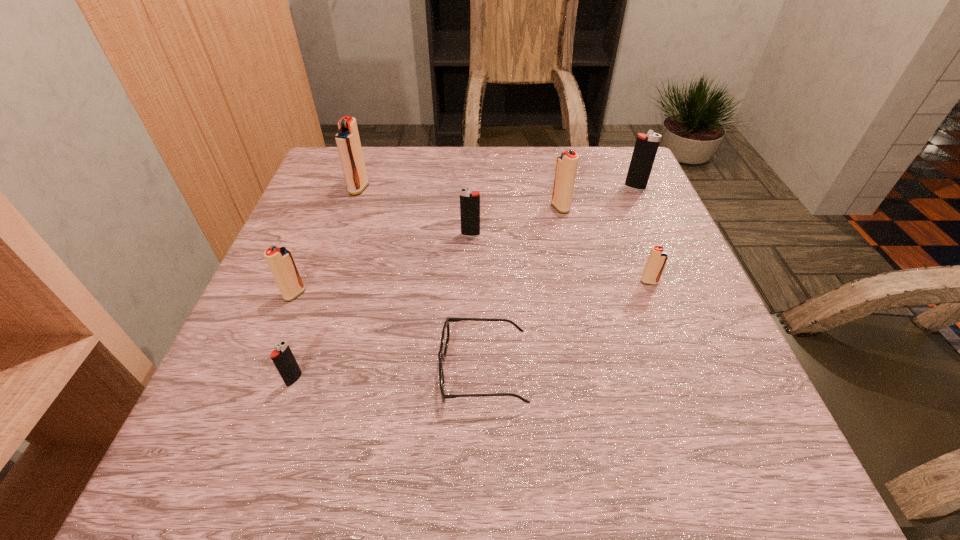
The image size is (960, 540). In order to click on free space that is in between the fourth farthest object and the sixth farthest igniter in this screenshot , I will do `click(383, 264)`.

This screenshot has width=960, height=540. I want to click on empty space that is in between the rightmost object and the tallest igniter, so click(x=497, y=188).

The image size is (960, 540). I want to click on free spot between the smallest black igniter and the rightmost red igniter, so click(471, 330).

Identify the location of the sixth closest object to the second red igniter from left to right. This screenshot has height=540, width=960. (646, 146).

What are the coordinates of `object that is the second closest to the sixth igniter from left to right` in the screenshot? It's located at (445, 335).

The height and width of the screenshot is (540, 960). I want to click on igniter that is the second closest one to the rightmost igniter, so click(x=657, y=259).

At what (x,y) coordinates should I click in order to perform the action: click on igniter that stands as the sixth closest to the nearest red igniter. Please return your answer as a coordinate pair (x, y). Image resolution: width=960 pixels, height=540 pixels. Looking at the image, I should click on (646, 146).

Identify which red igniter is the closest to the third biggest red igniter. Please provide its 2D coordinates. Your answer should be formatted as a tuple, i.e. [(x, y)], where the tuple contains the x and y coordinates of a point satisfying the conditions above.

[(347, 139)]

Image resolution: width=960 pixels, height=540 pixels. I want to click on red igniter that is the third nearest to the leftmost red igniter, so click(657, 259).

The image size is (960, 540). What are the coordinates of `black igniter that is the second closest to the second black igniter from left to right` in the screenshot? It's located at (283, 358).